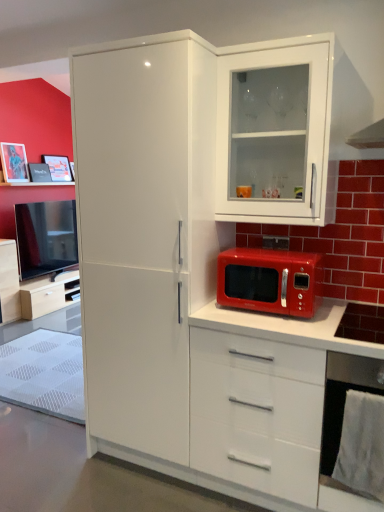
Question: Is white glossy cabinet at upper right, which ranks as the 1th cabinetry in top-to-bottom order, situated inside matte black phone at center or outside?

Choices:
 (A) inside
 (B) outside

Answer: (B)

Question: From the image's perspective, is white glossy cabinet at upper right, which ranks as the 1th cabinetry in top-to-bottom order, located above or below matte black phone at center?

Choices:
 (A) below
 (B) above

Answer: (B)

Question: Which object is positioned farthest from the metallic silver oven at lower right?

Choices:
 (A) matte black picture frame at upper left, the first picture frame viewed from the back
 (B) brushed metal picture frame at upper left, which is counted as the first picture frame, starting from the left
 (C) white glossy refrigerator at center
 (D) matte white cabinet at left, marked as the 2th cabinetry in a front-to-back arrangement
 (E) matte black phone at center

Answer: (A)

Question: Based on their relative distances, which object is farther from the brushed metal picture frame at upper left, the 2th picture frame when ordered from right to left?

Choices:
 (A) matte black phone at center
 (B) matte white cabinet at left, which ranks as the 1th cabinetry in back-to-front order
 (C) matte black picture frame at upper left, placed as the second picture frame when sorted from front to back
 (D) metallic silver oven at lower right
 (E) white glossy refrigerator at center

Answer: (D)